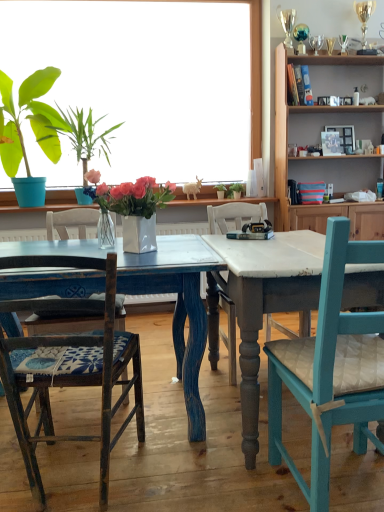
Question: From the image's perspective, is green leafy plant at center, the 5th houseplant from the front, located above or below green leafy plant at upper left, which is counted as the third houseplant, starting from the front?

Choices:
 (A) below
 (B) above

Answer: (A)

Question: Visually, is green leafy plant at center, the first houseplant positioned from the right, positioned to the left or to the right of green leafy plant at upper left, which is counted as the third houseplant, starting from the front?

Choices:
 (A) right
 (B) left

Answer: (A)

Question: Estimate the real-world distances between objects in this image. Which object is farther from the distressed blue wood table at center?

Choices:
 (A) green matte plant pot at center, which ranks as the second houseplant in right-to-left order
 (B) white glossy vase at center, arranged as the 3th houseplant when viewed from the left
 (C) wooden chair with blue patterned cushion at left, the second chair when ordered from right to left
 (D) green leafy plant in blue pot at left, the 1th houseplant positioned from the left
 (E) teal wood chair at right, positioned as the 1th chair in right-to-left order

Answer: (A)

Question: Which object is positioned farthest from the green leafy plant at center, the 5th houseplant from the front?

Choices:
 (A) green leafy plant at upper left, acting as the fourth houseplant starting from the right
 (B) teal wood chair at right, positioned as the 1th chair in right-to-left order
 (C) white glossy vase at center, arranged as the 3th houseplant when viewed from the left
 (D) wooden cabinet at upper right
 (E) wooden chair with blue patterned cushion at left, the second chair when ordered from right to left

Answer: (E)